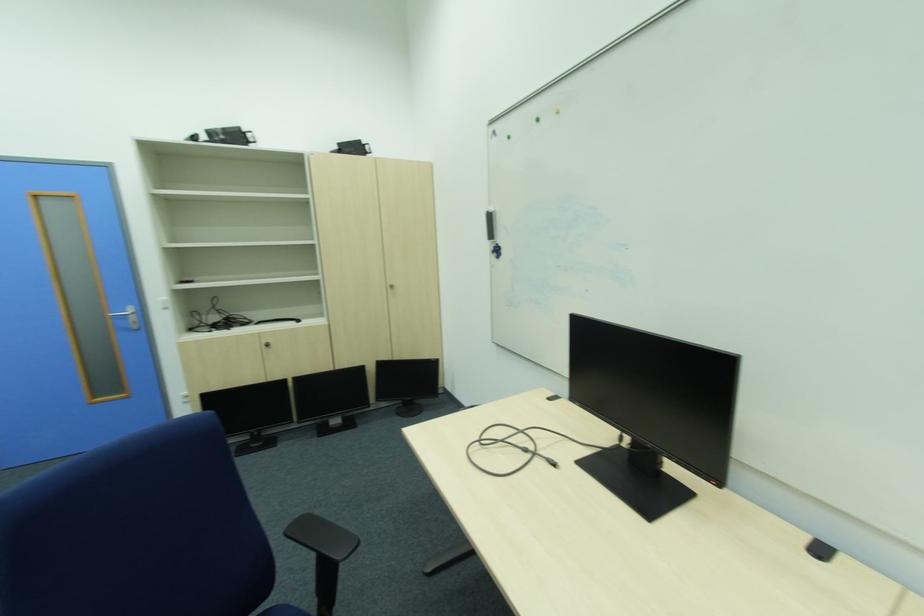
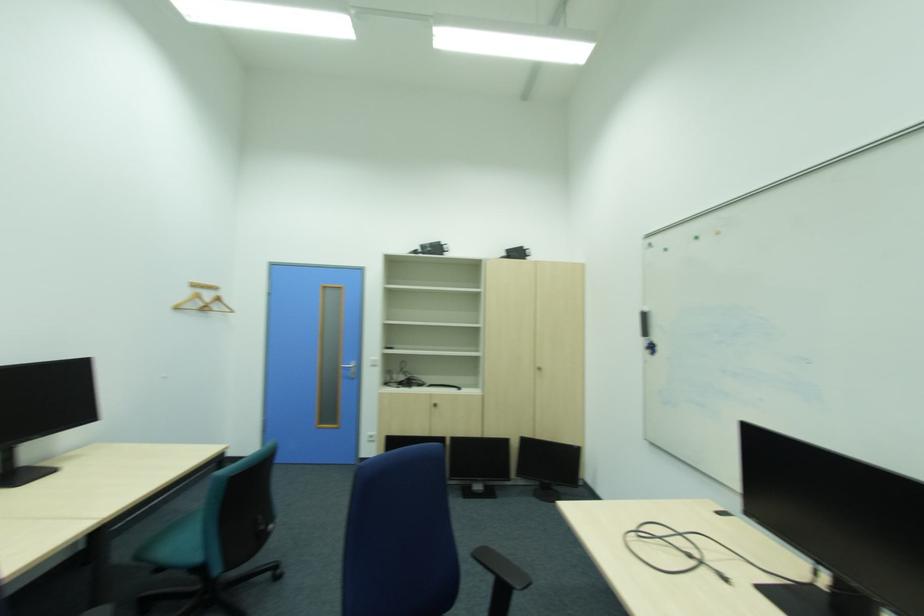
Find the pixel in the second image that matches point (564, 113) in the first image.

(725, 233)